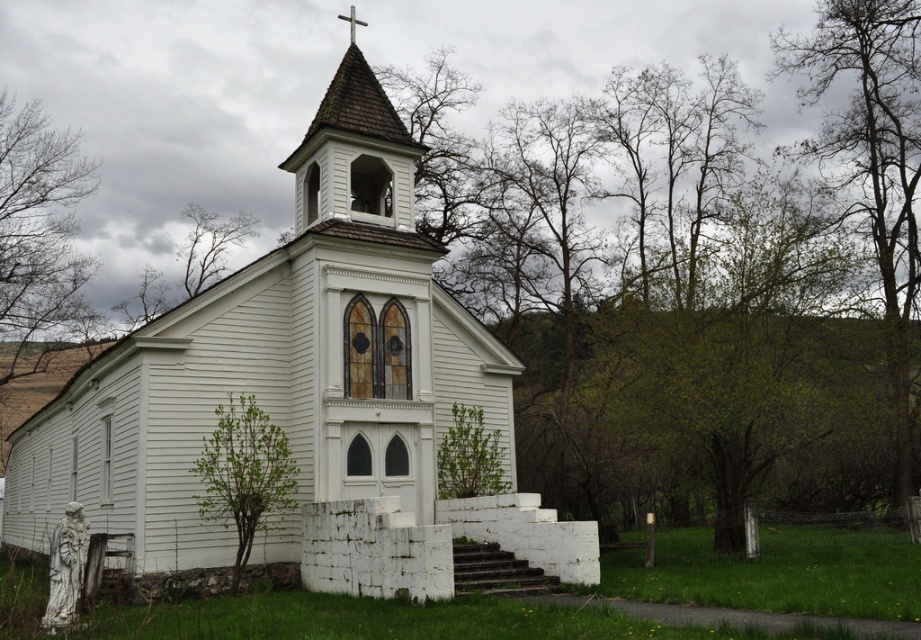
Does green leafy tree at center appear over green leafy tree at lower left?

Indeed, green leafy tree at center is positioned over green leafy tree at lower left.

Measure the distance between green leafy tree at center and green leafy tree at lower left.

green leafy tree at center is 94.35 feet away from green leafy tree at lower left.

Is point (710, 150) farther from viewer compared to point (226, 444)?

That is True.

The height and width of the screenshot is (640, 921). In order to click on green leafy tree at center in this screenshot , I will do `click(697, 272)`.

Is point (864, 6) positioned before point (224, 442)?

That is False.

Between green leafy tree at right and green leafy tree at lower left, which one is positioned higher?

Positioned higher is green leafy tree at right.

The image size is (921, 640). I want to click on green leafy tree at right, so click(873, 164).

Does point (327, 168) lie behind point (210, 250)?

No, (327, 168) is closer to viewer.

Locate an element on the screen. The height and width of the screenshot is (640, 921). wooden shingles at upper center is located at coordinates (354, 152).

I want to click on wooden shingles at upper center, so click(354, 152).